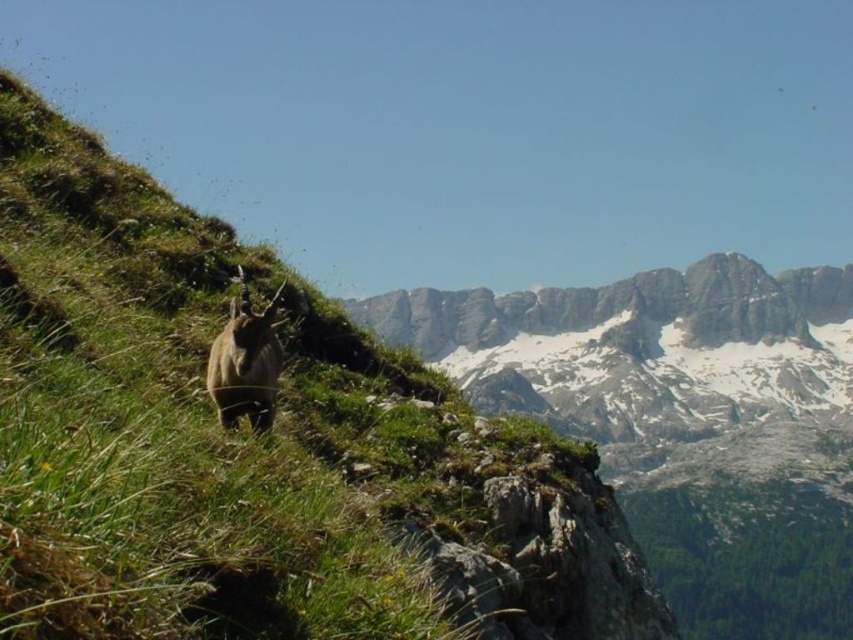
You are a hiker standing at the bottom of the green grassy hillside at center. You want to climb up to the top. Which direction should you move relative to the slope?

The green grassy hillside at center is positioned at point (254, 448), so you should move towards the upper part of the slope to reach the top.

You are a hiker trying to cross the green grassy hillside at center. There is a brown furry goat at center blocking your path. Can you walk around the goat on either side?

The green grassy hillside at center is wider than the brown furry goat at center, so you can walk around the goat on either side.

You are standing at the point marked by point (254, 448), which is on the green grassy hillside at center. You want to walk to the wild goat on the slope. Which direction should you go to reach it?

The wild goat is moving towards the right side of the frame, so you should head in the direction it is facing to reach it.